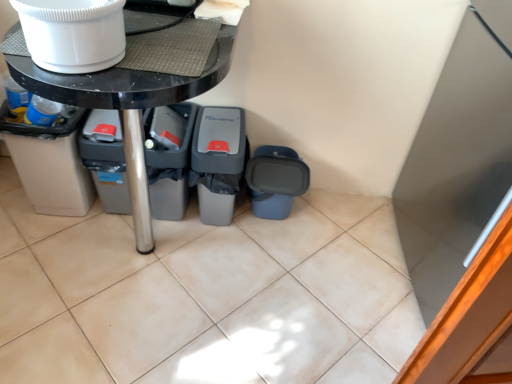
Find the location of a particular element. This screenshot has height=384, width=512. vacant space situated above gray plastic recycling bin at center, marked as the 3th recycling bin in a left-to-right arrangement (from a real-world perspective) is located at coordinates (222, 118).